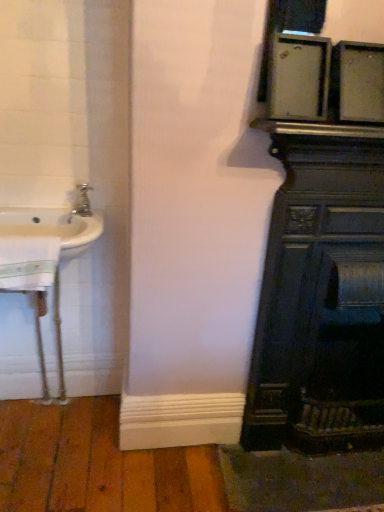
Question: Does brushed metal faucet at left have a greater height compared to dark wood fireplace at right?

Choices:
 (A) no
 (B) yes

Answer: (A)

Question: Considering the relative sizes of brushed metal faucet at left and dark wood fireplace at right in the image provided, is brushed metal faucet at left thinner than dark wood fireplace at right?

Choices:
 (A) no
 (B) yes

Answer: (B)

Question: Does brushed metal faucet at left have a larger size compared to dark wood fireplace at right?

Choices:
 (A) yes
 (B) no

Answer: (B)

Question: Is brushed metal faucet at left behind dark wood fireplace at right?

Choices:
 (A) yes
 (B) no

Answer: (A)

Question: From the image's perspective, is brushed metal faucet at left under dark wood fireplace at right?

Choices:
 (A) yes
 (B) no

Answer: (B)

Question: Would you say brushed metal faucet at left contains dark wood fireplace at right?

Choices:
 (A) no
 (B) yes

Answer: (A)

Question: Does dark wood fireplace at right touch white glossy sink at left?

Choices:
 (A) no
 (B) yes

Answer: (A)

Question: Is dark wood fireplace at right at the right side of white glossy sink at left?

Choices:
 (A) yes
 (B) no

Answer: (A)

Question: Is dark wood fireplace at right oriented towards white glossy sink at left?

Choices:
 (A) no
 (B) yes

Answer: (A)

Question: Considering the relative sizes of dark wood fireplace at right and white glossy sink at left in the image provided, is dark wood fireplace at right thinner than white glossy sink at left?

Choices:
 (A) no
 (B) yes

Answer: (B)

Question: Can you confirm if dark wood fireplace at right is bigger than white glossy sink at left?

Choices:
 (A) yes
 (B) no

Answer: (A)

Question: Is dark wood fireplace at right positioned far away from white glossy sink at left?

Choices:
 (A) yes
 (B) no

Answer: (B)

Question: Considering the relative sizes of white glossy sink at left and dark wood fireplace at right in the image provided, is white glossy sink at left wider than dark wood fireplace at right?

Choices:
 (A) no
 (B) yes

Answer: (B)